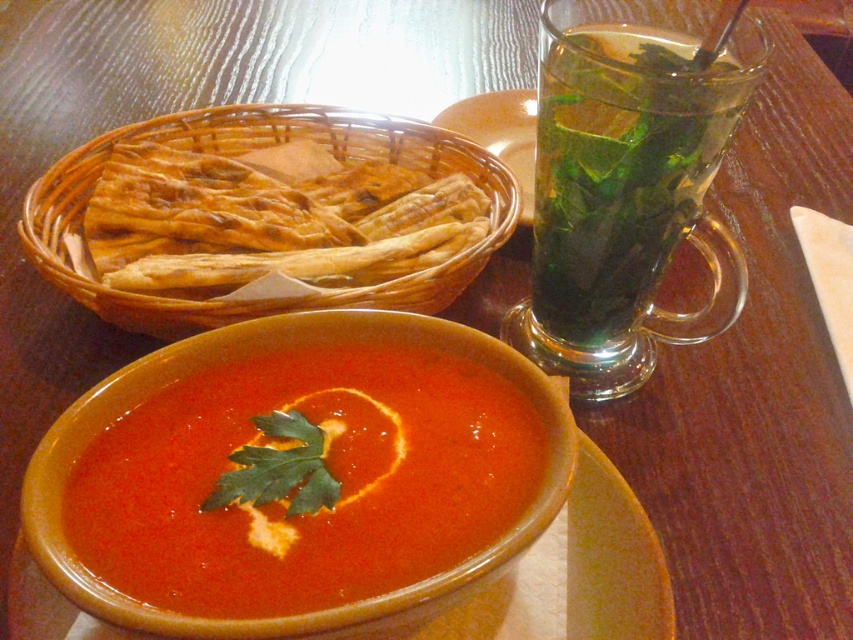
Question: Does smooth matte tomato soup at center appear on the right side of golden brown wicker basket at upper left?

Choices:
 (A) no
 (B) yes

Answer: (B)

Question: Among these points, which one is farthest from the camera?

Choices:
 (A) (606, 236)
 (B) (248, 458)
 (C) (105, 188)

Answer: (C)

Question: Does smooth matte tomato soup at center appear on the left side of green leafy liquid at upper right?

Choices:
 (A) no
 (B) yes

Answer: (B)

Question: Which point is closer to the camera taking this photo?

Choices:
 (A) (589, 42)
 (B) (146, 188)
 (C) (329, 420)

Answer: (C)

Question: Can you confirm if smooth matte tomato soup at center is positioned below green leafy liquid at upper right?

Choices:
 (A) yes
 (B) no

Answer: (A)

Question: Among these objects, which one is farthest from the camera?

Choices:
 (A) green leafy liquid at upper right
 (B) golden brown wicker basket at upper left
 (C) smooth matte tomato soup at center

Answer: (B)